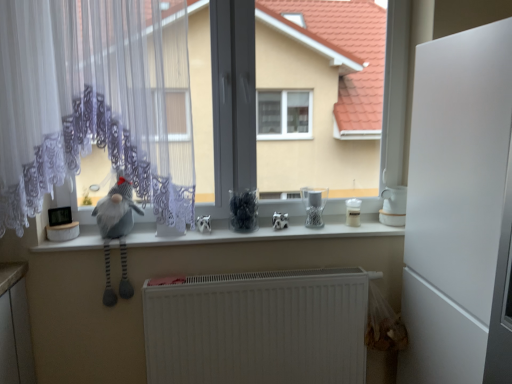
Question: Considering the positions of gray fabric gnome at left and white glossy teapot at right, the first appliance positioned from the right, in the image, is gray fabric gnome at left taller or shorter than white glossy teapot at right, the first appliance positioned from the right,?

Choices:
 (A) short
 (B) tall

Answer: (B)

Question: Which is correct: gray fabric gnome at left is inside white glossy teapot at right, the first appliance positioned from the right, or outside of it?

Choices:
 (A) inside
 (B) outside

Answer: (B)

Question: Considering the real-world distances, which object is closest to the white lace curtain at left?

Choices:
 (A) white lace curtain at left
 (B) white glossy counter top at center
 (C) gray fabric gnome at left
 (D) clear glass jar at center, which is counted as the 3th appliance, starting from the right
 (E) white matte refrigerator at right

Answer: (A)

Question: Which object is positioned farthest from the white matte radiator at lower center?

Choices:
 (A) clear glass jar at center, which is counted as the 3th appliance, starting from the right
 (B) white glossy counter top at center
 (C) white matte refrigerator at right
 (D) white glossy teapot at right, the first appliance positioned from the right
 (E) white lace curtain at left

Answer: (D)